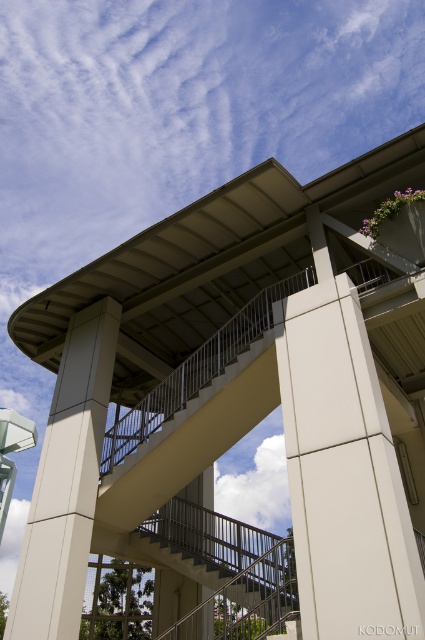
Is beige concrete pillar at center closer to camera compared to metallic gray staircase at center?

Yes.

Is point (54, 561) positioned behind point (170, 632)?

That is False.

Find the location of a particular element. This screenshot has height=640, width=425. beige concrete pillar at center is located at coordinates (65, 483).

Does white smooth pillar at center come behind metallic gray staircase at center?

No.

Does white smooth pillar at center have a lesser width compared to metallic gray staircase at center?

In fact, white smooth pillar at center might be wider than metallic gray staircase at center.

Between point (351, 355) and point (294, 600), which one is positioned in front?

Point (351, 355) is in front.

The image size is (425, 640). What are the coordinates of `white smooth pillar at center` in the screenshot? It's located at (343, 474).

Between white smooth pillar at center and beige concrete pillar at center, which one has less height?

white smooth pillar at center is shorter.

Between white smooth pillar at center and beige concrete pillar at center, which one is positioned lower?

Positioned lower is beige concrete pillar at center.

This screenshot has height=640, width=425. Describe the element at coordinates (343, 474) in the screenshot. I see `white smooth pillar at center` at that location.

Locate an element on the screen. This screenshot has height=640, width=425. white smooth pillar at center is located at coordinates (343, 474).